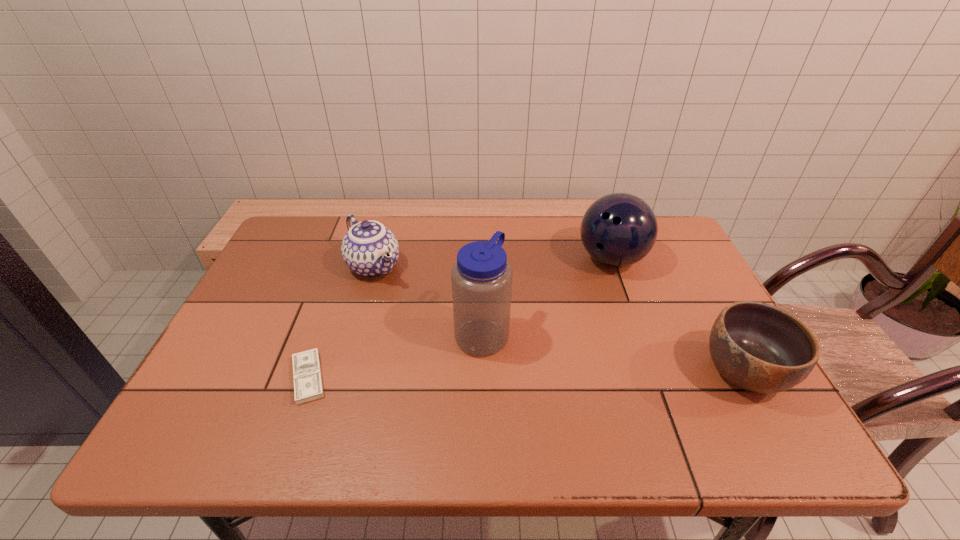
The height and width of the screenshot is (540, 960). Identify the location of the shortest object. (307, 376).

Locate an element on the screen. This screenshot has width=960, height=540. bowl is located at coordinates (757, 347).

The image size is (960, 540). Find the location of `chinaware`. chinaware is located at coordinates (370, 249).

What are the coordinates of `bowling ball` in the screenshot? It's located at (619, 229).

The width and height of the screenshot is (960, 540). In order to click on the second object from right to left in this screenshot , I will do `click(619, 229)`.

The height and width of the screenshot is (540, 960). Identify the location of the tallest object. (481, 278).

The height and width of the screenshot is (540, 960). I want to click on water bottle, so click(481, 278).

Where is `blank space located on the right of the money`? This screenshot has height=540, width=960. blank space located on the right of the money is located at coordinates (383, 377).

Locate an element on the screen. vacant area located 0.080m on the back of the bowl is located at coordinates (713, 315).

At what (x,y) coordinates should I click in order to perform the action: click on free space located from the spout of the chinaware. Please return your answer as a coordinate pair (x, y). The width and height of the screenshot is (960, 540). Looking at the image, I should click on (398, 302).